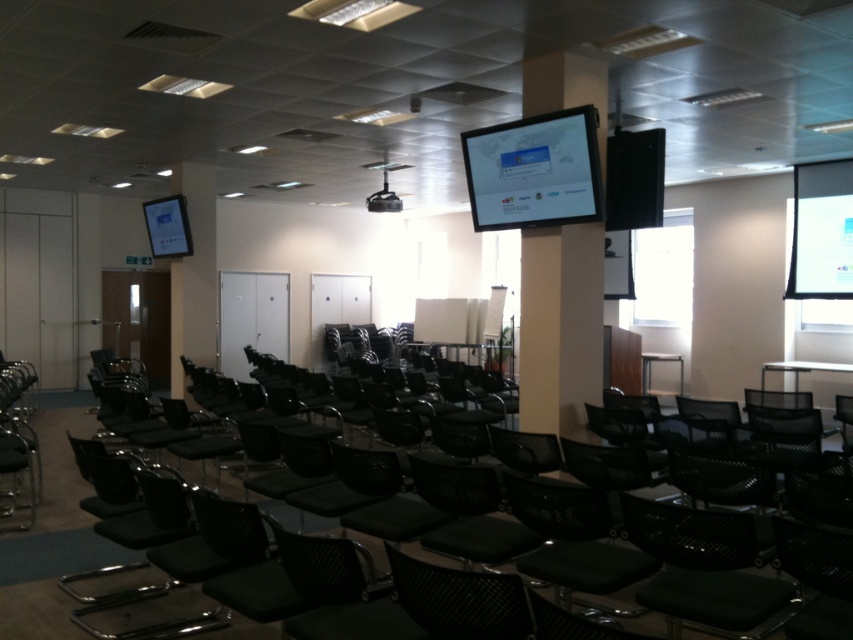
Question: Can you confirm if black mesh chair at lower left is wider than white matte projection screen at upper right?

Choices:
 (A) no
 (B) yes

Answer: (B)

Question: Does matte black monitor at center appear over black plastic projector at center?

Choices:
 (A) yes
 (B) no

Answer: (B)

Question: Is black mesh chair at lower left closer to the viewer compared to black plastic projector at center?

Choices:
 (A) no
 (B) yes

Answer: (B)

Question: Which point appears closest to the camera in this image?

Choices:
 (A) (177, 244)
 (B) (381, 211)
 (C) (845, 198)

Answer: (C)

Question: Based on their relative distances, which object is nearer to the white matte projection screen at upper right?

Choices:
 (A) black plastic projector at center
 (B) matte black tablet at upper left
 (C) black mesh swivel chair at lower right
 (D) black mesh chair at lower left

Answer: (A)

Question: Which point is farther to the camera?

Choices:
 (A) (395, 209)
 (B) (714, 604)
 (C) (686, 598)

Answer: (A)